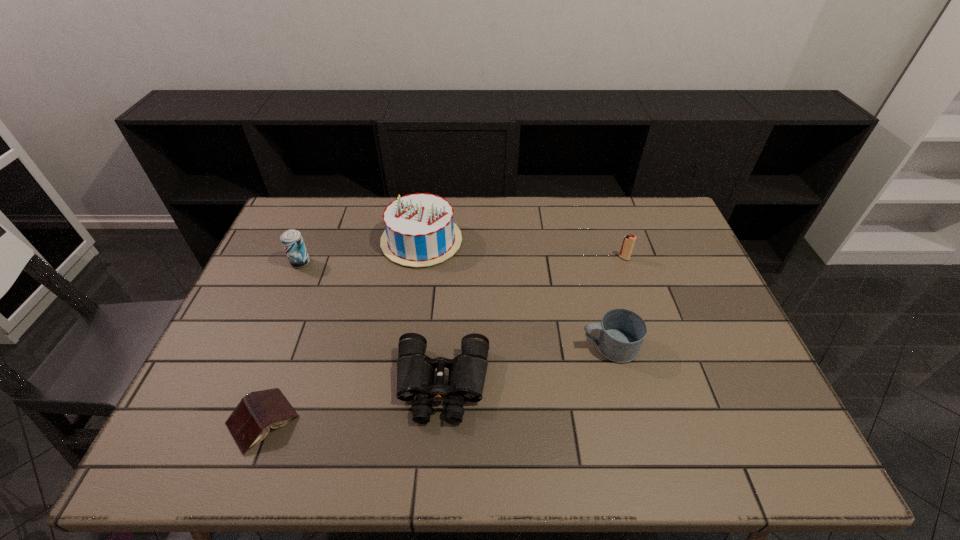
Find the location of a particular element. This screenshot has width=960, height=540. free space between the igniter and the beer can is located at coordinates (463, 260).

The width and height of the screenshot is (960, 540). In order to click on empty space between the shortest object and the beer can in this screenshot , I will do `click(281, 341)`.

You are a GUI agent. You are given a task and a screenshot of the screen. Output one action in this format:
    pyautogui.click(x=<x>, y=<y>)
    Task: Click on the free space between the beer can and the shortest object
    
    Given the screenshot: What is the action you would take?
    pyautogui.click(x=281, y=341)

This screenshot has width=960, height=540. In order to click on free space that is in between the rightmost object and the beer can in this screenshot , I will do `click(463, 260)`.

Select which object appears as the closest to the second shortest object. Please provide its 2D coordinates. Your answer should be formatted as a tuple, i.e. [(x, y)], where the tuple contains the x and y coordinates of a point satisfying the conditions above.

[(249, 423)]

At what (x,y) coordinates should I click in order to perform the action: click on the second closest object relative to the tallest object. Please return your answer as a coordinate pair (x, y). Image resolution: width=960 pixels, height=540 pixels. Looking at the image, I should click on (415, 371).

You are a GUI agent. You are given a task and a screenshot of the screen. Output one action in this format:
    pyautogui.click(x=<x>, y=<y>)
    Task: Click on the free space that satisfies the following two spatial constraints: 1. on the front side of the tallest object; 2. on the right side of the igniter
    The height and width of the screenshot is (540, 960).
    Given the screenshot: What is the action you would take?
    pyautogui.click(x=420, y=258)

This screenshot has height=540, width=960. I want to click on free region that satisfies the following two spatial constraints: 1. on the side of the fifth object from left to right with the handle; 2. through the eyepieces of the binoculars, so click(619, 384).